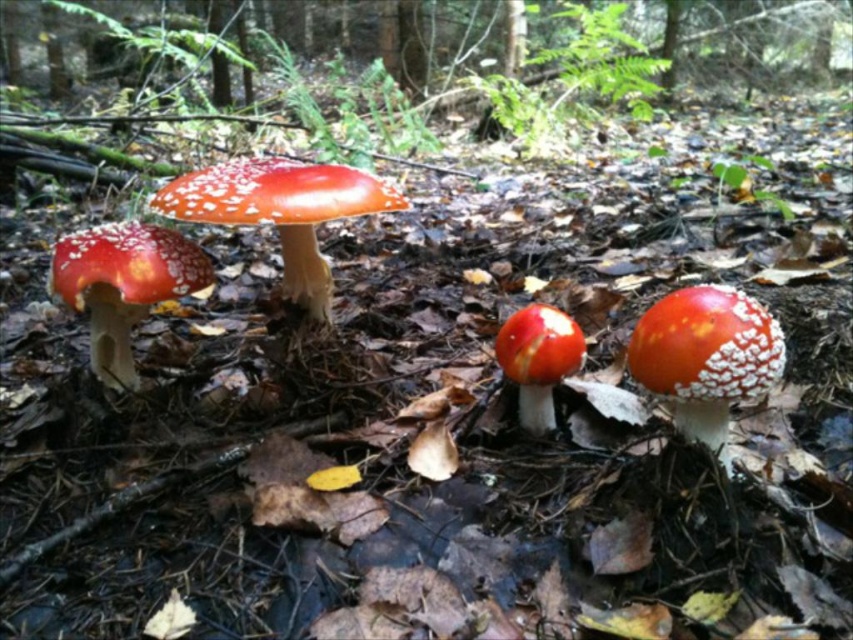
Question: Which of the following is the closest to the observer?

Choices:
 (A) shiny red mushroom at center
 (B) smooth white mushroom at center
 (C) matte red mushroom at left

Answer: (A)

Question: Is the position of smooth red mushroom at center less distant than that of smooth white mushroom at center?

Choices:
 (A) yes
 (B) no

Answer: (A)

Question: Is shiny red mushroom at center to the left of matte red mushroom at left from the viewer's perspective?

Choices:
 (A) no
 (B) yes

Answer: (A)

Question: Which of these objects is positioned farthest from the smooth red mushroom at center?

Choices:
 (A) smooth white mushroom at center
 (B) matte red mushroom at left
 (C) shiny red mushroom at center

Answer: (B)

Question: Based on their relative distances, which object is nearer to the smooth white mushroom at center?

Choices:
 (A) matte red mushroom at left
 (B) smooth red mushroom at center
 (C) shiny red mushroom at center

Answer: (B)

Question: Can you confirm if shiny red mushroom at center is thinner than smooth white mushroom at center?

Choices:
 (A) yes
 (B) no

Answer: (B)